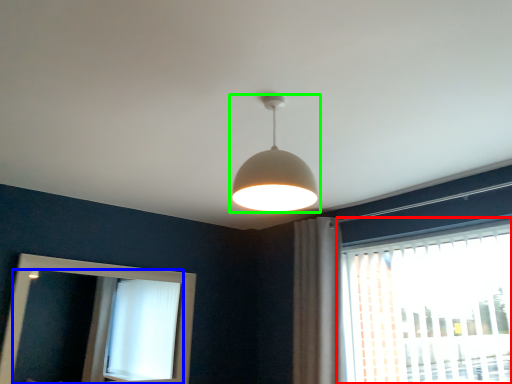
Question: Considering the real-world distances, which object is farthest from window (highlighted by a red box)? mirror (highlighted by a blue box) or lamp (highlighted by a green box)?

Choices:
 (A) mirror
 (B) lamp

Answer: (A)